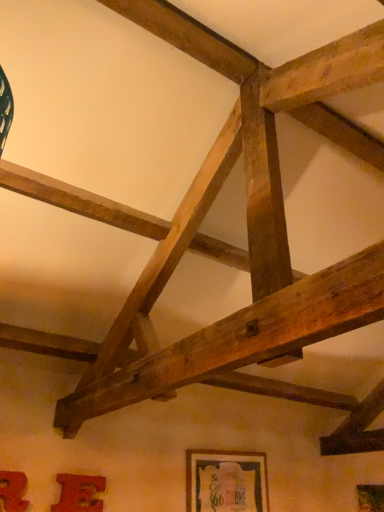
Question: From the image's perspective, is wooden framed poster at lower center, the 1th picture frame viewed from the right, located above matte red picture frame at lower left, the second picture frame viewed from the front?

Choices:
 (A) yes
 (B) no

Answer: (B)

Question: Is wooden framed poster at lower center, which is the third picture frame in left-to-right order, smaller than matte red picture frame at lower left, acting as the 2th picture frame starting from the right?

Choices:
 (A) no
 (B) yes

Answer: (A)

Question: From a real-world perspective, is wooden framed poster at lower center, which is the third picture frame in left-to-right order, on top of matte red picture frame at lower left, which is counted as the second picture frame, starting from the back?

Choices:
 (A) no
 (B) yes

Answer: (B)

Question: Is matte red picture frame at lower left, the 2th picture frame from the left, inside wooden framed poster at lower center, which is counted as the 3th picture frame, starting from the front?

Choices:
 (A) yes
 (B) no

Answer: (B)

Question: Does wooden framed poster at lower center, which is the third picture frame in left-to-right order, have a greater width compared to matte red picture frame at lower left, acting as the 2th picture frame starting from the right?

Choices:
 (A) yes
 (B) no

Answer: (A)

Question: Choose the correct answer: Is matte red picture frame at lower left, which is counted as the second picture frame, starting from the back, inside matte red picture frame at lower left, which is the 1th picture frame in left-to-right order, or outside it?

Choices:
 (A) inside
 (B) outside

Answer: (B)

Question: Considering their positions, is matte red picture frame at lower left, which is counted as the second picture frame, starting from the back, located in front of or behind matte red picture frame at lower left, which is the first picture frame in front-to-back order?

Choices:
 (A) front
 (B) behind

Answer: (B)

Question: From a real-world perspective, is matte red picture frame at lower left, the second picture frame viewed from the front, positioned above or below matte red picture frame at lower left, which appears as the third picture frame when viewed from the back?

Choices:
 (A) above
 (B) below

Answer: (B)

Question: From the image's perspective, is matte red picture frame at lower left, the 2th picture frame from the left, positioned above or below matte red picture frame at lower left, which is the first picture frame in front-to-back order?

Choices:
 (A) below
 (B) above

Answer: (A)

Question: Considering the relative positions of matte red picture frame at lower left, which is the first picture frame in front-to-back order, and wooden framed poster at lower center, which is the third picture frame in left-to-right order, in the image provided, is matte red picture frame at lower left, which is the first picture frame in front-to-back order, to the left or to the right of wooden framed poster at lower center, which is the third picture frame in left-to-right order,?

Choices:
 (A) left
 (B) right

Answer: (A)

Question: From the image's perspective, is matte red picture frame at lower left, which is the 1th picture frame in left-to-right order, above or below wooden framed poster at lower center, positioned as the 1th picture frame in back-to-front order?

Choices:
 (A) below
 (B) above

Answer: (B)

Question: From their relative heights in the image, would you say matte red picture frame at lower left, which is the first picture frame in front-to-back order, is taller or shorter than wooden framed poster at lower center, which is counted as the 3th picture frame, starting from the front?

Choices:
 (A) short
 (B) tall

Answer: (A)

Question: Based on their sizes in the image, would you say matte red picture frame at lower left, which appears as the third picture frame when viewed from the back, is bigger or smaller than wooden framed poster at lower center, positioned as the 1th picture frame in back-to-front order?

Choices:
 (A) big
 (B) small

Answer: (B)

Question: Is point (19, 494) positioned closer to the camera than point (66, 487)?

Choices:
 (A) closer
 (B) farther

Answer: (A)

Question: Relative to matte red picture frame at lower left, the second picture frame viewed from the front, is matte red picture frame at lower left, which is the 1th picture frame in left-to-right order, in front or behind?

Choices:
 (A) front
 (B) behind

Answer: (A)